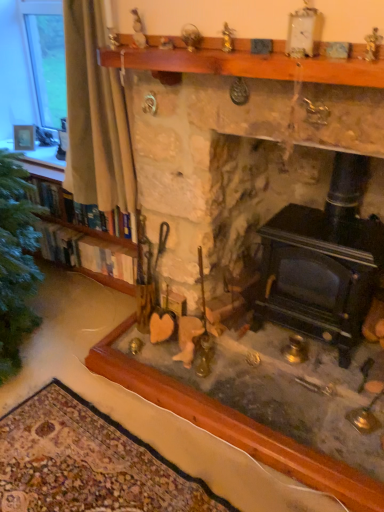
You are a GUI agent. You are given a task and a screenshot of the screen. Output one action in this format:
    pyautogui.click(x=<x>, y=<y>)
    Task: Click on the free space above black cast iron wood burning stove at lower right (from a real-world perspective)
    This screenshot has width=384, height=512.
    Given the screenshot: What is the action you would take?
    pyautogui.click(x=329, y=223)